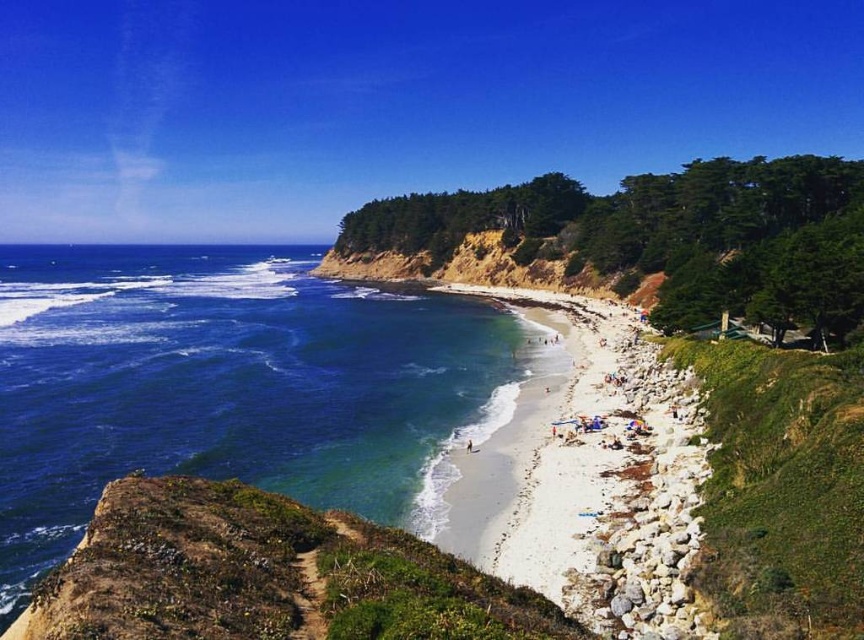
You are planning to set up a temporary tent for a coastal event. The tent requires a flat area that is at least 20 meters wide. Based on the scene, which location between the green mossy cliff at lower left and the white sand beach at center would be more suitable for setting up the tent?

The green mossy cliff at lower left has a larger width than the white sand beach at center, so it would be more suitable for setting up the tent as it likely provides a wider flat area meeting the 20 meters requirement.

You are a hiker planning to reach the white sand beach at center from the green mossy cliff at lower left. Based on the scene, which direction should you move relative to the cliff to get to the beach?

To reach the white sand beach at center from the green mossy cliff at lower left, you should move upward since the green mossy cliff at lower left is located below the white sand beach at center.

You are a photographer standing on the beach and want to capture both the blue water at lower left and the green mossy cliff at lower left in the same frame. Which object will appear larger in your photo?

The blue water at lower left will appear larger in the photo because it is taller than the green mossy cliff at lower left.